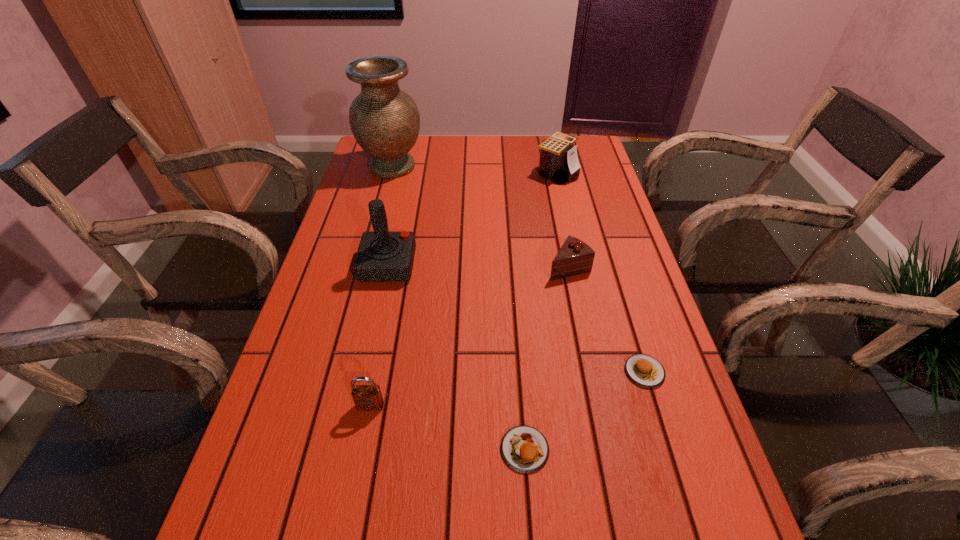
The height and width of the screenshot is (540, 960). Find the location of `free space between the nearest object and the right food`. free space between the nearest object and the right food is located at coordinates (585, 410).

The image size is (960, 540). I want to click on free space between the sixth shortest object and the padlock, so click(379, 335).

Identify the location of vacant region between the vase and the fifth farthest object. The width and height of the screenshot is (960, 540). (518, 269).

Identify the location of free space between the second nearest object and the left food. (447, 428).

Find the location of a particular element. free space between the fifth farthest object and the sixth farthest object is located at coordinates (508, 389).

The image size is (960, 540). What are the coordinates of `free space between the third shortest object and the calculator` in the screenshot? It's located at (563, 220).

You are a GUI agent. You are given a task and a screenshot of the screen. Output one action in this format:
    pyautogui.click(x=<x>, y=<y>)
    Task: Click on the free spot between the sixth farthest object and the tallest object
    The width and height of the screenshot is (960, 540).
    Given the screenshot: What is the action you would take?
    pyautogui.click(x=381, y=286)

Where is `free space between the tallest object and the fifth farthest object`? free space between the tallest object and the fifth farthest object is located at coordinates (518, 269).

The height and width of the screenshot is (540, 960). I want to click on free spot between the chocolate cake and the right food, so click(x=607, y=320).

Locate an element on the screen. The image size is (960, 540). unoccupied position between the joystick and the padlock is located at coordinates (379, 335).